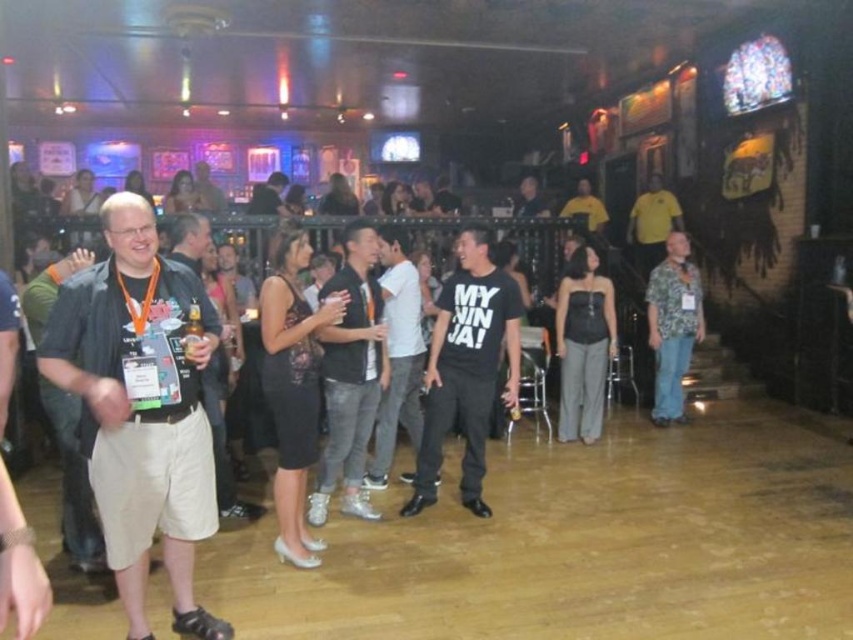
Question: Is black matte shirt at center closer to the viewer compared to hawaiian print shirt at right?

Choices:
 (A) no
 (B) yes

Answer: (B)

Question: Which of these objects is positioned closest to the black matte t-shirt at center?

Choices:
 (A) white matte shirt at center
 (B) matte black t-shirt at center
 (C) hawaiian print shirt at right

Answer: (A)

Question: Does black matte t-shirt at center appear on the right side of yellow cotton shirt at upper right?

Choices:
 (A) yes
 (B) no

Answer: (B)

Question: Which of the following is the closest to the observer?

Choices:
 (A) (245, 506)
 (B) (479, 353)
 (C) (65, 298)

Answer: (C)

Question: Which point appears closest to the camera in this image?

Choices:
 (A) (218, 289)
 (B) (351, 257)

Answer: (B)

Question: Does dark gray shirt at left have a lesser width compared to black matte shirt at center?

Choices:
 (A) no
 (B) yes

Answer: (A)